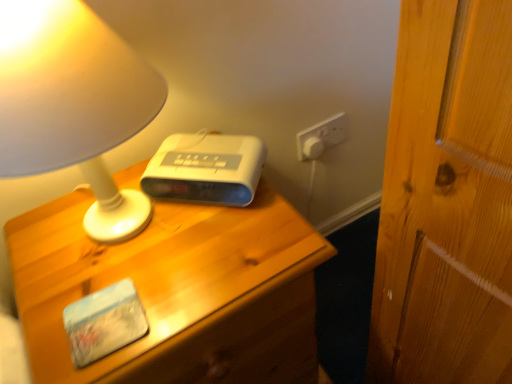
Question: Is point (118, 226) closer or farther from the camera than point (77, 192)?

Choices:
 (A) farther
 (B) closer

Answer: (B)

Question: Considering the positions of matte white lamp at upper left and wooden nightstand at center in the image, is matte white lamp at upper left taller or shorter than wooden nightstand at center?

Choices:
 (A) tall
 (B) short

Answer: (B)

Question: Estimate the real-world distances between objects in this image. Which object is closer to the wooden nightstand at center?

Choices:
 (A) matte white lamp at upper left
 (B) white plastic alarm clock at center

Answer: (B)

Question: Based on their relative distances, which object is farther from the matte white lamp at upper left?

Choices:
 (A) wooden nightstand at center
 (B) white plastic alarm clock at center

Answer: (A)